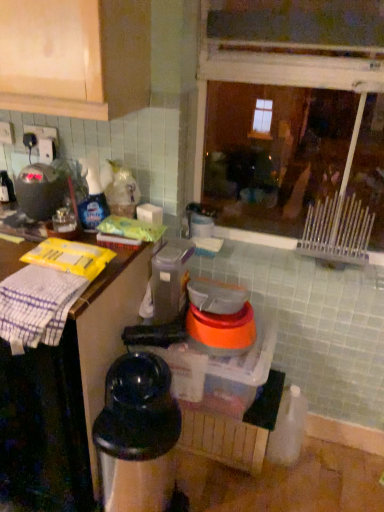
Question: From a real-world perspective, is orange plastic bowls at center, the 2th appliance ordered from the bottom, physically located above or below white cloth at left?

Choices:
 (A) below
 (B) above

Answer: (B)

Question: Looking at the image, does orange plastic bowls at center, the 2th appliance ordered from the bottom, seem bigger or smaller compared to white cloth at left?

Choices:
 (A) big
 (B) small

Answer: (B)

Question: Estimate the real-world distances between objects in this image. Which object is closer to the white checkered cloth at left?

Choices:
 (A) orange plastic bowls at center, positioned as the 3th appliance in left-to-right order
 (B) transparent glass window at upper center
 (C) matte black kettle at left, which appears as the third appliance when viewed from the right
 (D) white cloth at left
 (E) black plastic coffee maker at lower left, the third appliance when ordered from top to bottom

Answer: (D)

Question: Which object is positioned farthest from the white checkered cloth at left?

Choices:
 (A) black plastic coffee maker at lower left, marked as the 2th appliance in a right-to-left arrangement
 (B) transparent glass window at upper center
 (C) matte black kettle at left, placed as the first appliance when sorted from left to right
 (D) orange plastic bowls at center, marked as the first appliance in a right-to-left arrangement
 (E) white cloth at left

Answer: (B)